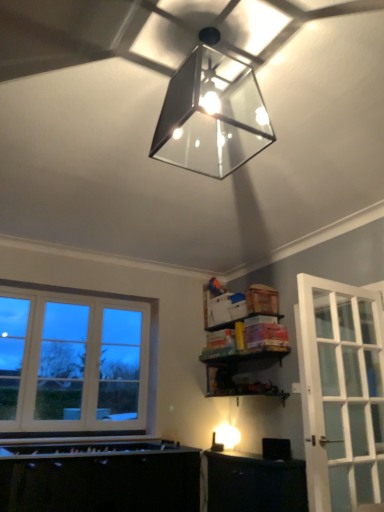
Locate an element on the screen. The height and width of the screenshot is (512, 384). black plastic speaker at lower right is located at coordinates (276, 449).

The height and width of the screenshot is (512, 384). Describe the element at coordinates (276, 449) in the screenshot. I see `black plastic speaker at lower right` at that location.

Where is `matte glass lampshade at upper center`? Image resolution: width=384 pixels, height=512 pixels. matte glass lampshade at upper center is located at coordinates (212, 116).

What do you see at coordinates (212, 116) in the screenshot? I see `matte glass lampshade at upper center` at bounding box center [212, 116].

In order to face matte glass lampshade at upper center, should I rotate leftwards or rightwards?

A 1.816 degree turn to the right will do.

Where is `black plastic speaker at lower right`? The width and height of the screenshot is (384, 512). black plastic speaker at lower right is located at coordinates (276, 449).

Considering the positions of objects black plastic speaker at lower right and matte glass lampshade at upper center in the image provided, who is more to the left, black plastic speaker at lower right or matte glass lampshade at upper center?

matte glass lampshade at upper center.

Who is more distant, black plastic speaker at lower right or matte glass lampshade at upper center?

black plastic speaker at lower right is further from the camera.

Does point (271, 450) appear closer or farther from the camera than point (223, 138)?

Clearly, point (271, 450) is more distant from the camera than point (223, 138).

Consider the image. From the image's perspective, between black plastic speaker at lower right and matte glass lampshade at upper center, which one is located above?

From the image's view, matte glass lampshade at upper center is above.

From a real-world perspective, relative to matte glass lampshade at upper center, is black plastic speaker at lower right vertically above or below?

Clearly, from a real-world perspective, black plastic speaker at lower right is below matte glass lampshade at upper center.

Is black plastic speaker at lower right wider than matte glass lampshade at upper center?

No.

Considering the relative sizes of black plastic speaker at lower right and matte glass lampshade at upper center in the image provided, is black plastic speaker at lower right taller than matte glass lampshade at upper center?

No.

Which of these two, black plastic speaker at lower right or matte glass lampshade at upper center, is smaller?

black plastic speaker at lower right is smaller.

Is matte glass lampshade at upper center completely or partially inside black plastic speaker at lower right?

No.

Would you say black plastic speaker at lower right is a long distance from matte glass lampshade at upper center?

That's right, there is a large distance between black plastic speaker at lower right and matte glass lampshade at upper center.

Is black plastic speaker at lower right facing away from matte glass lampshade at upper center?

No, matte glass lampshade at upper center is not at the back of black plastic speaker at lower right.

Measure the distance from black plastic speaker at lower right to matte glass lampshade at upper center.

8.90 feet.

This screenshot has height=512, width=384. Identify the location of appliance below the matte glass lampshade at upper center (from the image's perspective). (276, 449).

Is matte glass lampshade at upper center at the right side of black plastic speaker at lower right?

Incorrect, matte glass lampshade at upper center is not on the right side of black plastic speaker at lower right.

Relative to black plastic speaker at lower right, is matte glass lampshade at upper center in front or behind?

Clearly, matte glass lampshade at upper center is in front of black plastic speaker at lower right.

Considering the positions of point (155, 141) and point (286, 454), is point (155, 141) closer or farther from the camera than point (286, 454)?

Point (155, 141) is closer to the camera than point (286, 454).

From the image's perspective, which object appears higher, matte glass lampshade at upper center or black plastic speaker at lower right?

matte glass lampshade at upper center appears higher in the image.

From a real-world perspective, is matte glass lampshade at upper center physically located above or below black plastic speaker at lower right?

matte glass lampshade at upper center is above black plastic speaker at lower right.

Does matte glass lampshade at upper center have a lesser width compared to black plastic speaker at lower right?

Incorrect, the width of matte glass lampshade at upper center is not less than that of black plastic speaker at lower right.

Can you confirm if matte glass lampshade at upper center is shorter than black plastic speaker at lower right?

No, matte glass lampshade at upper center is not shorter than black plastic speaker at lower right.

Looking at the image, does matte glass lampshade at upper center seem bigger or smaller compared to black plastic speaker at lower right?

Answer: In the image, matte glass lampshade at upper center appears to be larger than black plastic speaker at lower right.

Is matte glass lampshade at upper center positioned beyond the bounds of black plastic speaker at lower right?

Yes, matte glass lampshade at upper center is outside of black plastic speaker at lower right.

Are matte glass lampshade at upper center and black plastic speaker at lower right far apart?

That's right, there is a large distance between matte glass lampshade at upper center and black plastic speaker at lower right.

Is matte glass lampshade at upper center oriented away from black plastic speaker at lower right?

No, black plastic speaker at lower right is not at the back of matte glass lampshade at upper center.

How far apart are matte glass lampshade at upper center and black plastic speaker at lower right?

matte glass lampshade at upper center and black plastic speaker at lower right are 8.90 feet apart from each other.

Locate an element on the screen. lamp lying on the left of black plastic speaker at lower right is located at coordinates (212, 116).

The image size is (384, 512). In order to click on lamp lying above the black plastic speaker at lower right (from the image's perspective) in this screenshot , I will do `click(212, 116)`.

I want to click on appliance directly beneath the matte glass lampshade at upper center (from a real-world perspective), so click(x=276, y=449).